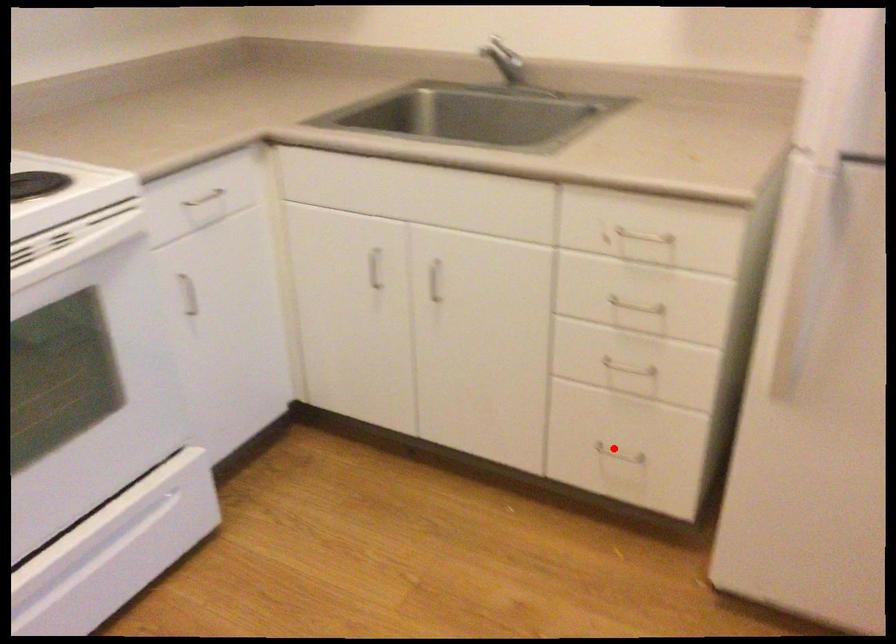
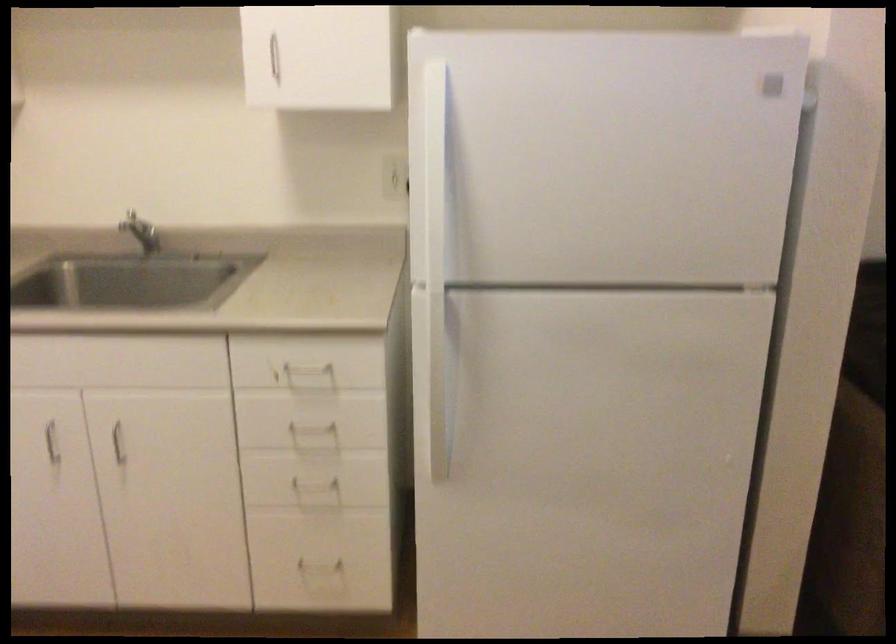
Question: A red point is marked in image1. In image2, is the corresponding 3D point closer to the camera or farther? Reply with the corresponding letter.

Choices:
 (A) The corresponding 3D point is closer.
 (B) The corresponding 3D point is farther.

Answer: (B)